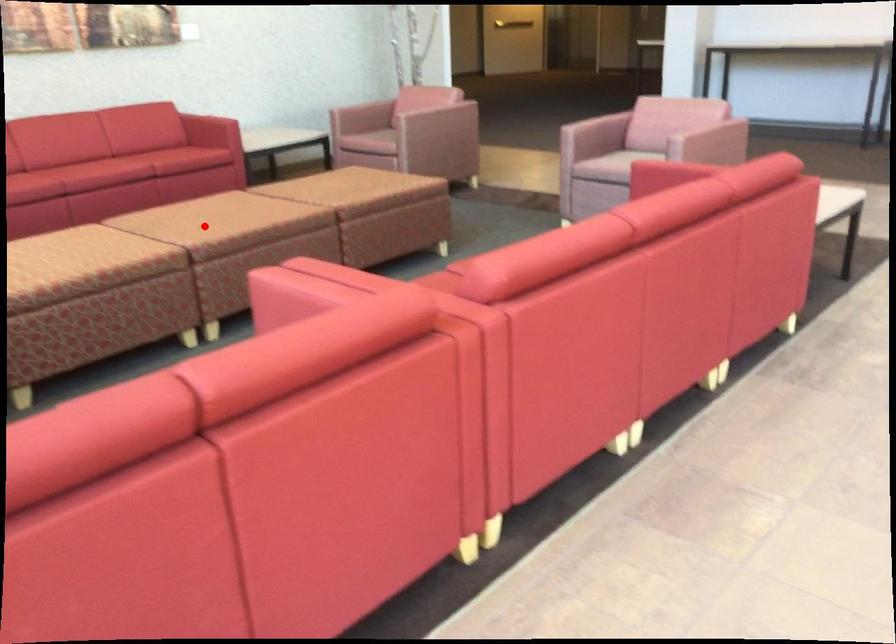
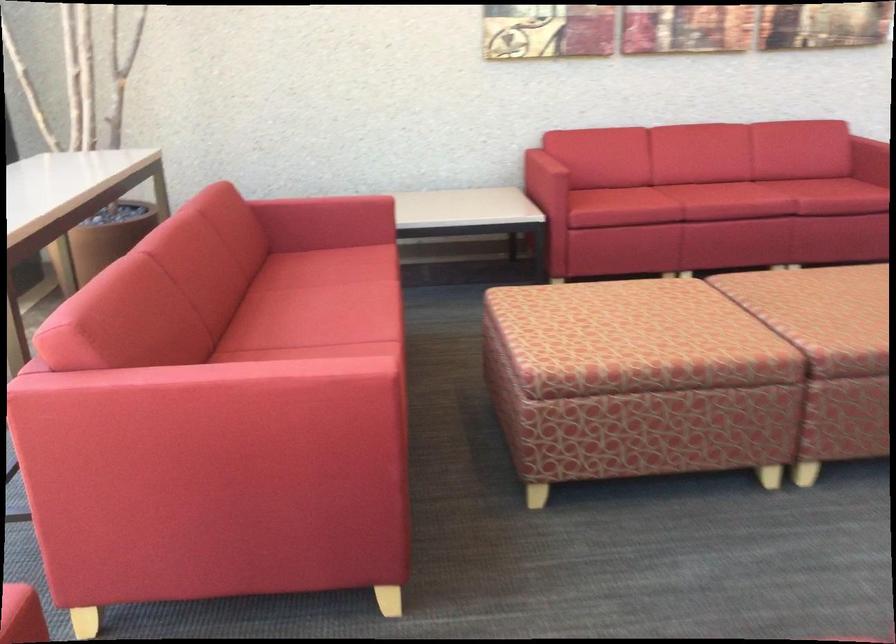
The point at the highlighted location is marked in the first image. Where is the corresponding point in the second image?

(834, 317)